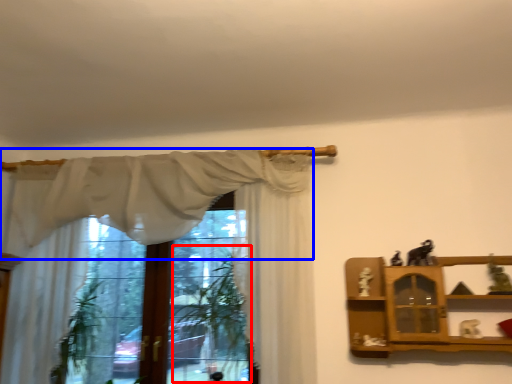
Question: Which object is further to the camera taking this photo, plant (highlighted by a red box) or curtain (highlighted by a blue box)?

Choices:
 (A) plant
 (B) curtain

Answer: (A)